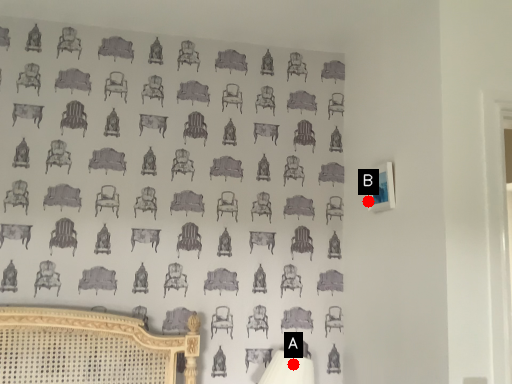
Question: Two points are circled on the image, labeled by A and B beside each circle. Among these points, which one is nearest to the camera?

Choices:
 (A) A is closer
 (B) B is closer

Answer: (A)